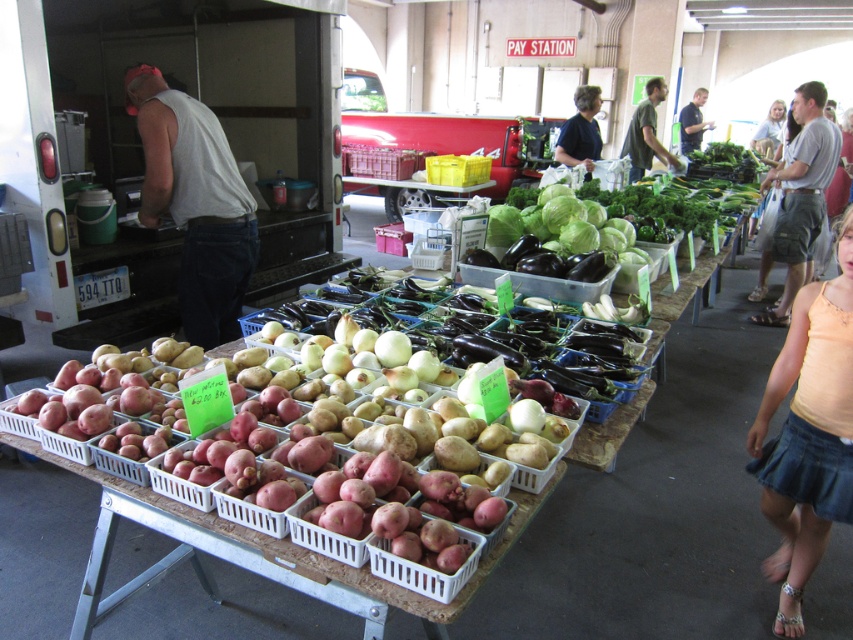
Which of these two, white tank top at center or green matte shirt at upper right, stands taller?

With more height is green matte shirt at upper right.

Image resolution: width=853 pixels, height=640 pixels. In order to click on white tank top at center in this screenshot , I will do `click(195, 204)`.

Looking at this image, is white tank top at center thinner than green leafy lettuce at center?

Indeed, white tank top at center has a lesser width compared to green leafy lettuce at center.

Can you confirm if white tank top at center is taller than green leafy lettuce at center?

Correct, white tank top at center is much taller as green leafy lettuce at center.

What do you see at coordinates (195, 204) in the screenshot? The image size is (853, 640). I see `white tank top at center` at bounding box center [195, 204].

Where is `white tank top at center`? The width and height of the screenshot is (853, 640). white tank top at center is located at coordinates (195, 204).

Is gray cotton t-shirt at upper right smaller than dark gray shirt at center?

A: Indeed, gray cotton t-shirt at upper right has a smaller size compared to dark gray shirt at center.

Locate an element on the screen. gray cotton t-shirt at upper right is located at coordinates (801, 195).